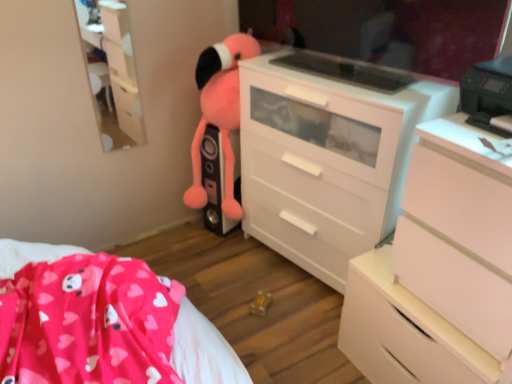
Identify the location of free point below glossy plastic mirror at upper center (from a real-world perspective). This screenshot has height=384, width=512. (362, 78).